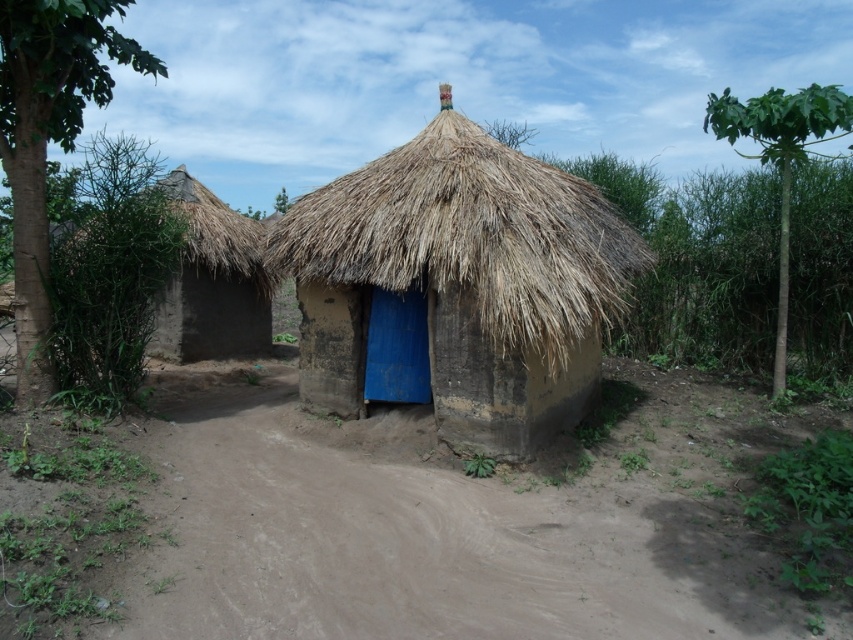
Question: Which of the following is the farthest from the observer?

Choices:
 (A) blue matte door at center
 (B) thatched straw hut at center
 (C) brown sandy dirt track at lower center
 (D) thatched mud hut at left

Answer: (D)

Question: Is the position of brown sandy dirt track at lower center less distant than that of thatched straw hut at center?

Choices:
 (A) no
 (B) yes

Answer: (B)

Question: Can you confirm if brown sandy dirt track at lower center is positioned below thatched straw hut at center?

Choices:
 (A) yes
 (B) no

Answer: (A)

Question: Does brown sandy dirt track at lower center appear under blue matte door at center?

Choices:
 (A) yes
 (B) no

Answer: (A)

Question: Among these objects, which one is nearest to the camera?

Choices:
 (A) brown sandy dirt track at lower center
 (B) thatched mud hut at left
 (C) thatched straw hut at center
 (D) blue matte door at center

Answer: (A)

Question: Among these points, which one is farthest from the camera?

Choices:
 (A) (409, 403)
 (B) (323, 477)
 (C) (440, 244)
 (D) (177, 202)

Answer: (D)